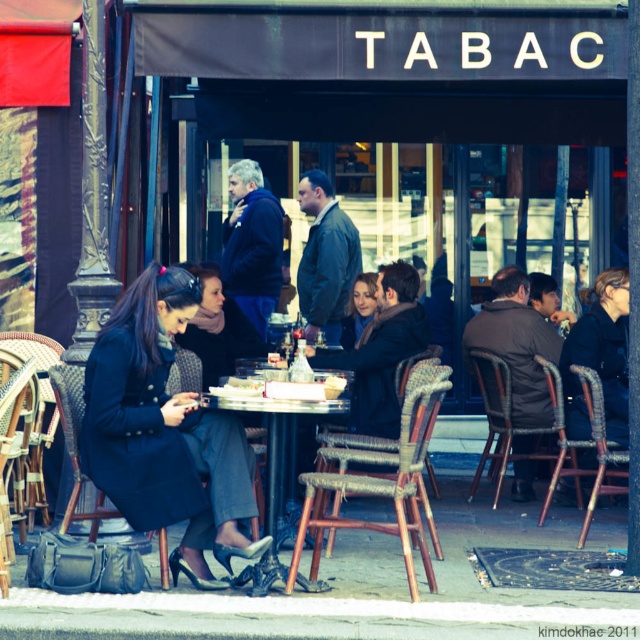
Does matte black coat at left have a larger size compared to matte black coat at center?

Yes.

Find the location of a particular element. The image size is (640, 640). matte black coat at left is located at coordinates (164, 432).

Locate an element on the screen. The width and height of the screenshot is (640, 640). matte black coat at left is located at coordinates (164, 432).

Does wooden table at center have a lesser height compared to matte black coat at center?

No, wooden table at center is not shorter than matte black coat at center.

Does wooden table at center have a smaller size compared to matte black coat at center?

Actually, wooden table at center might be larger than matte black coat at center.

Is point (273, 552) more distant than point (344, 333)?

That is False.

Where is `wooden table at center`? This screenshot has width=640, height=640. wooden table at center is located at coordinates (273, 432).

Between matte black coat at left and wooden table at center, which one is positioned higher?

matte black coat at left is higher up.

Can you confirm if matte black coat at left is positioned above wooden table at center?

Correct, matte black coat at left is located above wooden table at center.

Between point (134, 433) and point (221, 404), which one is positioned behind?

The point (134, 433) is more distant.

Find the location of a particular element. matte black coat at left is located at coordinates (164, 432).